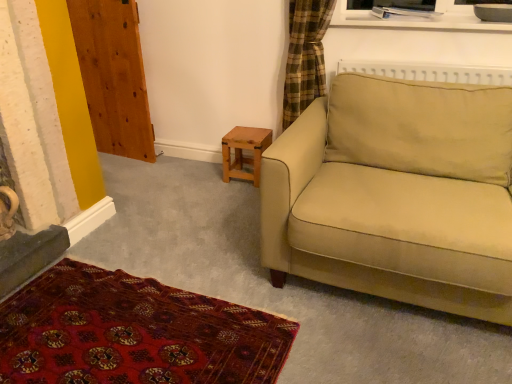
Identify the location of vacant area in front of wooden at left. This screenshot has height=384, width=512. click(x=125, y=169).